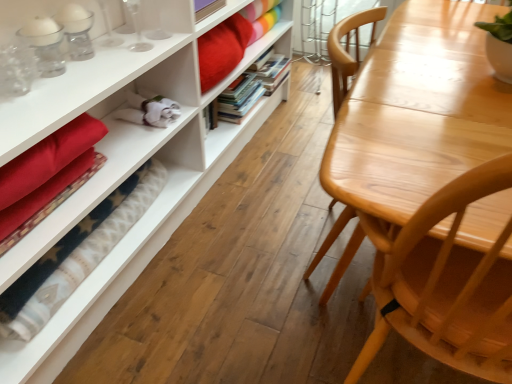
Locate an element on the screen. Image resolution: width=512 pixels, height=384 pixels. vacant area on top of velvet red blanket at lower left (from a real-world perspective) is located at coordinates (81, 243).